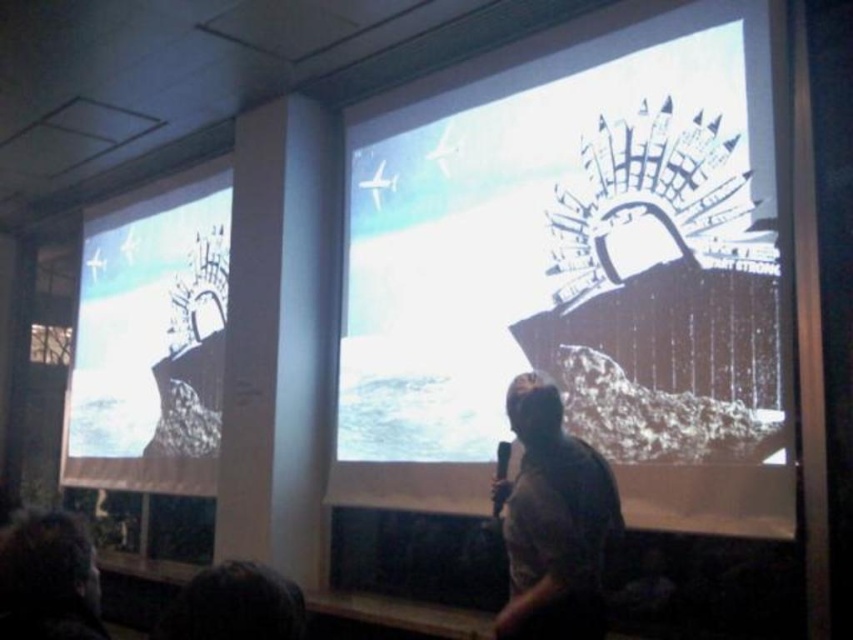
Between matte black ship at left and gray fabric shirt at center, which one appears on the right side from the viewer's perspective?

gray fabric shirt at center is more to the right.

Find the location of `matte black ship at left`. matte black ship at left is located at coordinates (151, 342).

The height and width of the screenshot is (640, 853). Identify the location of matte black ship at left. (151, 342).

Locate an element on the screen. The image size is (853, 640). matte black ship at left is located at coordinates [x=151, y=342].

Based on the photo, does white matte ship at center appear on the right side of matte black ship at left?

Yes, white matte ship at center is to the right of matte black ship at left.

What do you see at coordinates (577, 272) in the screenshot?
I see `white matte ship at center` at bounding box center [577, 272].

The height and width of the screenshot is (640, 853). I want to click on white matte ship at center, so click(577, 272).

Does white matte ship at center have a greater width compared to gray fabric shirt at center?

Indeed, white matte ship at center has a greater width compared to gray fabric shirt at center.

Between point (349, 218) and point (527, 616), which one is positioned behind?

The point (349, 218) is more distant.

The image size is (853, 640). What do you see at coordinates (577, 272) in the screenshot? I see `white matte ship at center` at bounding box center [577, 272].

Identify the location of white matte ship at center. This screenshot has height=640, width=853. (577, 272).